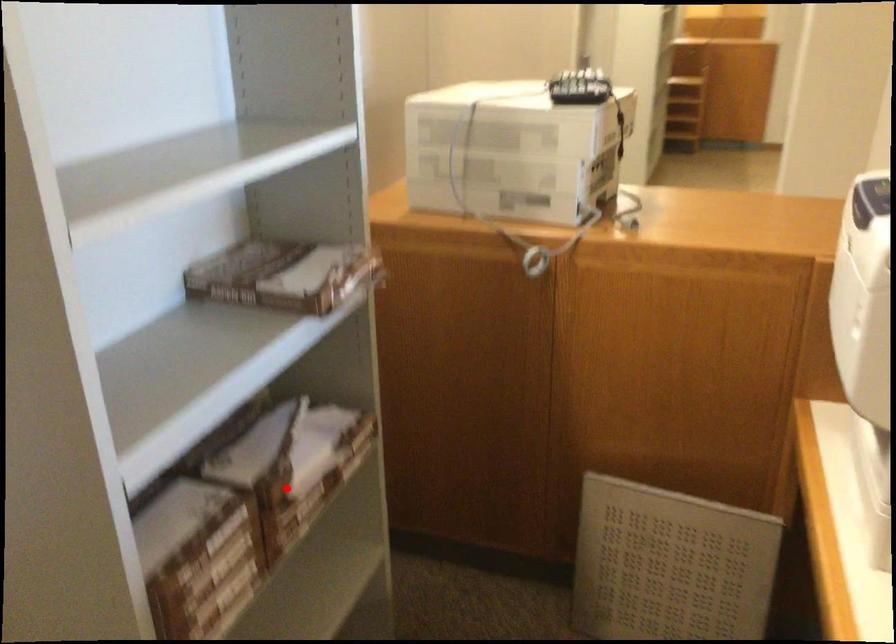
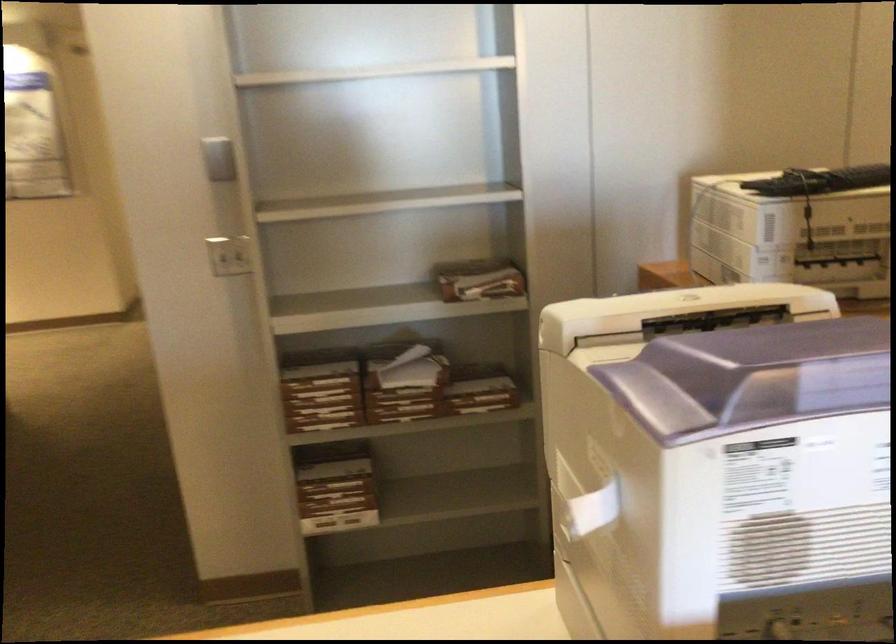
Question: I am providing you with two images of the same scene from different viewpoints. Image1 has a red point marked. In image2, the corresponding 3D location appears at what relative position? Reply with the corresponding letter.

Choices:
 (A) Closer
 (B) Farther

Answer: (B)